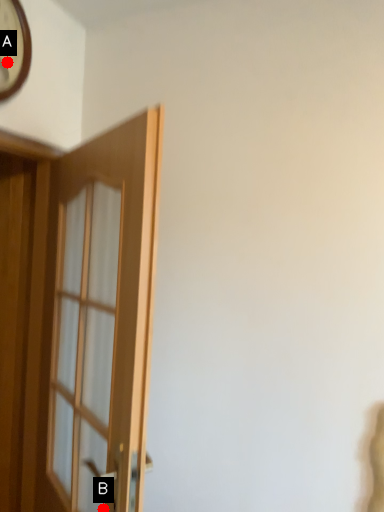
Question: Two points are circled on the image, labeled by A and B beside each circle. Which point appears closest to the camera in this image?

Choices:
 (A) A is closer
 (B) B is closer

Answer: (B)